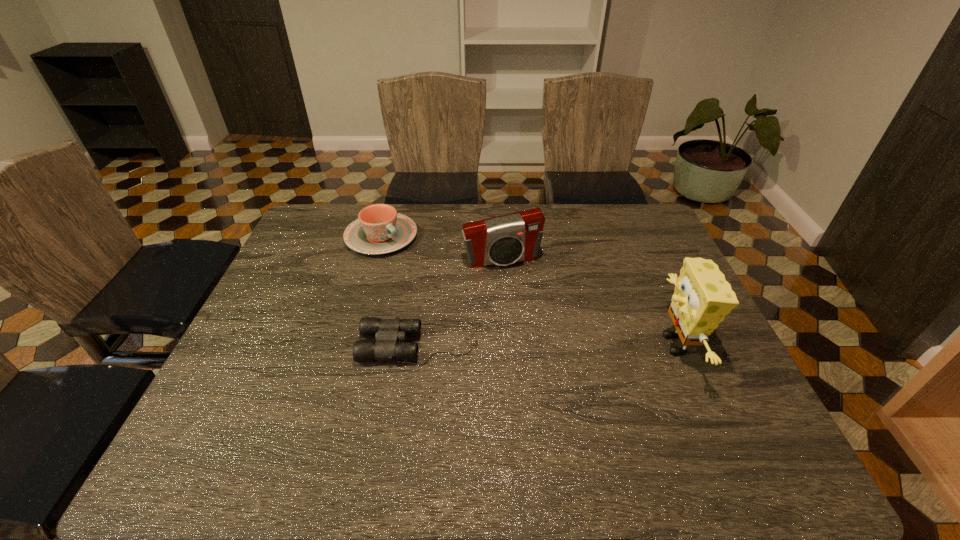
Find the location of a particular element. vacant space located on the face of the sponge is located at coordinates (590, 345).

Find the location of a particular element. The image size is (960, 540). vacant space situated on the front-facing side of the camera is located at coordinates (530, 321).

This screenshot has width=960, height=540. I want to click on vacant space located 0.230m on the front-facing side of the camera, so [x=532, y=327].

This screenshot has width=960, height=540. In order to click on free location located 0.090m on the front-facing side of the camera in this screenshot , I will do `click(517, 291)`.

Locate an element on the screen. The image size is (960, 540). free space located 0.360m on the handle side of the chinaware is located at coordinates (481, 313).

Locate an element on the screen. Image resolution: width=960 pixels, height=540 pixels. free space located 0.330m on the handle side of the chinaware is located at coordinates (473, 307).

I want to click on vacant space situated 0.140m on the handle side of the chinaware, so click(x=430, y=274).

What are the coordinates of `object positioned at the far edge` in the screenshot? It's located at (379, 229).

This screenshot has width=960, height=540. Identify the location of object that is at the near edge. (702, 298).

This screenshot has width=960, height=540. In order to click on object that is positioned at the left edge in this screenshot , I will do `click(379, 229)`.